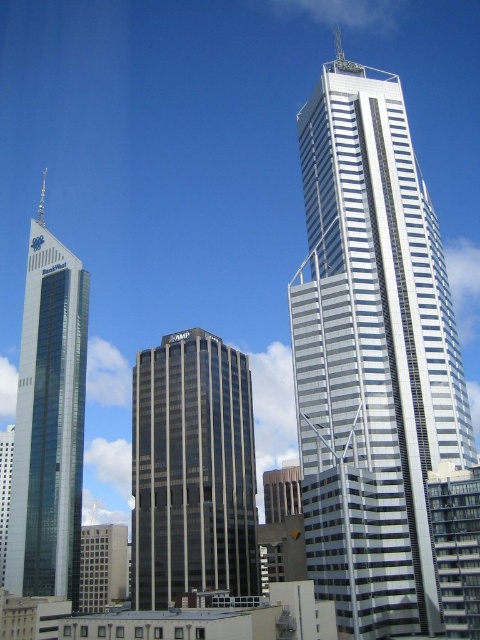
You are standing in the city looking at the skyscrapers. There are two points marked in the image. The first point is at coordinates point (244, 538) and the second point is at point (58, 378). Which point is closer to you?

Point (244, 538) is closer to the viewer than point (58, 378).

You are a city planner reviewing the cityscape. You need to determine which of the two buildings, the white glass skyscraper at upper right or the dark gray glass building at center, occupies more space in the image. Based on their sizes, which one would you choose?

The white glass skyscraper at upper right is bigger than the dark gray glass building at center, so it occupies more space in the image.

You are standing on the observation deck of the glassy reflective skyscraper at left and want to take a photo of the white glass skyscraper at upper right. Which direction should you point your camera to capture it?

You should point your camera to the right because the white glass skyscraper at upper right is closer to the viewer than the glassy reflective skyscraper at left, meaning it is positioned to the right side from your current location.